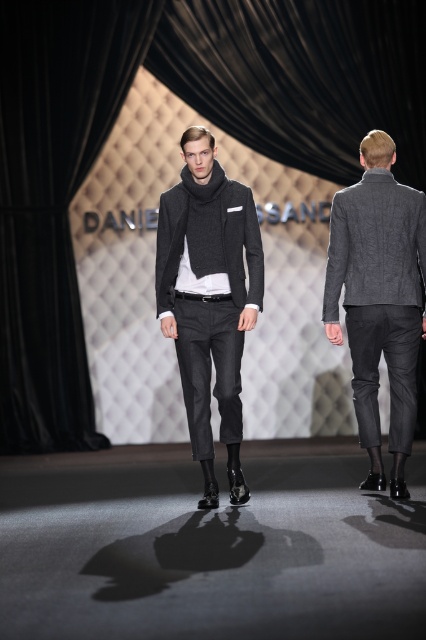
Question: Among these points, which one is farthest from the camera?

Choices:
 (A) (196, 381)
 (B) (40, 24)

Answer: (B)

Question: Which object is positioned farthest from the matte gray sweater at center?

Choices:
 (A) textured gray blazer at right
 (B) black velvet curtain at left

Answer: (B)

Question: Does black velvet curtain at left have a larger size compared to matte gray sweater at center?

Choices:
 (A) no
 (B) yes

Answer: (B)

Question: Is black velvet curtain at left to the right of matte gray sweater at center from the viewer's perspective?

Choices:
 (A) no
 (B) yes

Answer: (A)

Question: Which of the following is the closest to the observer?

Choices:
 (A) (391, 289)
 (B) (224, 349)

Answer: (A)

Question: Can you confirm if black velvet curtain at left is positioned below matte gray sweater at center?

Choices:
 (A) yes
 (B) no

Answer: (B)